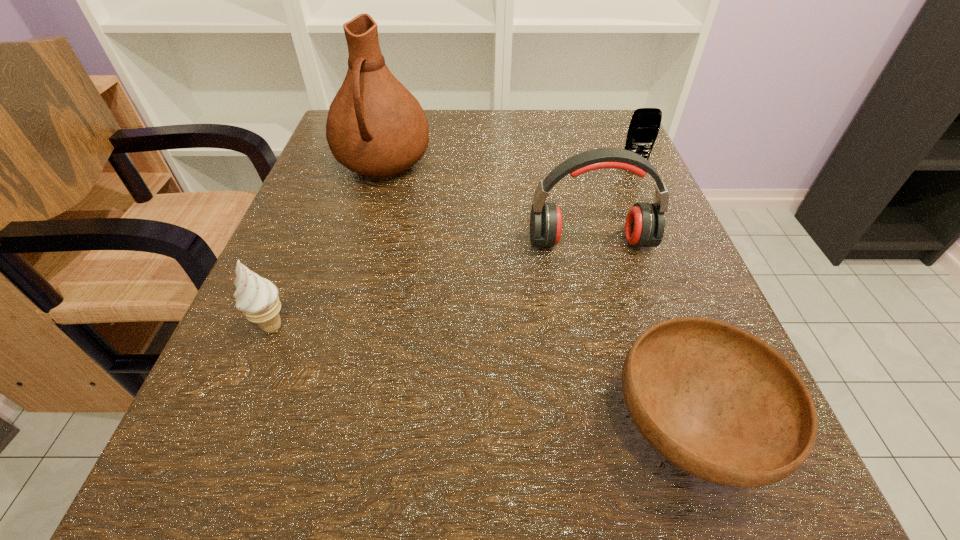
The height and width of the screenshot is (540, 960). What are the coordinates of `free space that satisfies the following two spatial constraints: 1. on the ear cups of the second tallest object; 2. on the left side of the nearest object` in the screenshot? It's located at (639, 429).

Locate an element on the screen. The image size is (960, 540). free location that satisfies the following two spatial constraints: 1. on the side of the bowl with the handle; 2. on the left side of the pitcher is located at coordinates (309, 429).

This screenshot has height=540, width=960. I want to click on vacant area in the image that satisfies the following two spatial constraints: 1. on the side of the shortest object with the handle; 2. on the right side of the pitcher, so click(x=309, y=429).

Identify the location of free space that satisfies the following two spatial constraints: 1. on the side of the nearest object with the handle; 2. on the right side of the tallest object. pos(309,429).

What are the coordinates of `free space that satisfies the following two spatial constraints: 1. on the screen of the cellular telephone; 2. on the front-facing side of the second nearest object` in the screenshot? It's located at (702, 326).

Where is `free space that satisfies the following two spatial constraints: 1. on the ear cups of the earphone; 2. on the left side of the bowl`? free space that satisfies the following two spatial constraints: 1. on the ear cups of the earphone; 2. on the left side of the bowl is located at coordinates (639, 429).

You are a GUI agent. You are given a task and a screenshot of the screen. Output one action in this format:
    pyautogui.click(x=<x>, y=<y>)
    Task: Click on the free location that satisfies the following two spatial constraints: 1. on the ear cups of the fourth shortest object; 2. on the left side of the bowl
    This screenshot has width=960, height=540.
    Given the screenshot: What is the action you would take?
    pyautogui.click(x=639, y=429)

You are a GUI agent. You are given a task and a screenshot of the screen. Output one action in this format:
    pyautogui.click(x=<x>, y=<y>)
    Task: Click on the vacant region that satisfies the following two spatial constraints: 1. on the front-facing side of the icecream; 2. on the left side of the bowl
    
    Given the screenshot: What is the action you would take?
    pyautogui.click(x=230, y=429)

Identify the location of free space that satisfies the following two spatial constraints: 1. on the ear cups of the second tallest object; 2. on the front-facing side of the icecream. The image size is (960, 540). (612, 326).

Locate an element on the screen. The height and width of the screenshot is (540, 960). free space that satisfies the following two spatial constraints: 1. on the ear cups of the third nearest object; 2. on the right side of the shortest object is located at coordinates (639, 429).